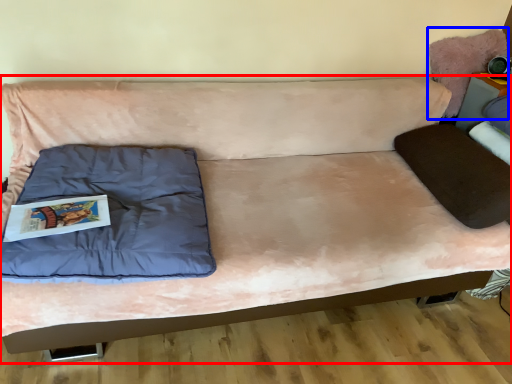
Question: Which object is closer to the camera taking this photo, studio couch (highlighted by a red box) or swivel chair (highlighted by a blue box)?

Choices:
 (A) studio couch
 (B) swivel chair

Answer: (A)